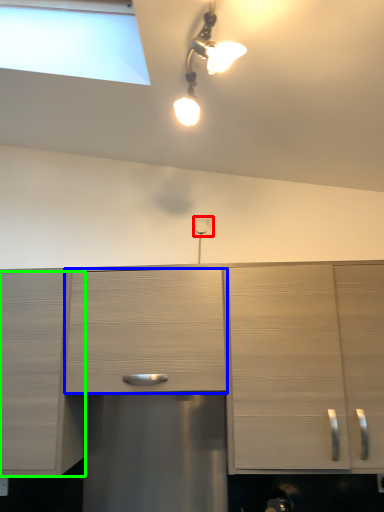
Question: Estimate the real-world distances between objects in this image. Which object is farther from electric outlet (highlighted by a red box), drawer (highlighted by a blue box) or cabinetry (highlighted by a green box)?

Choices:
 (A) drawer
 (B) cabinetry

Answer: (B)